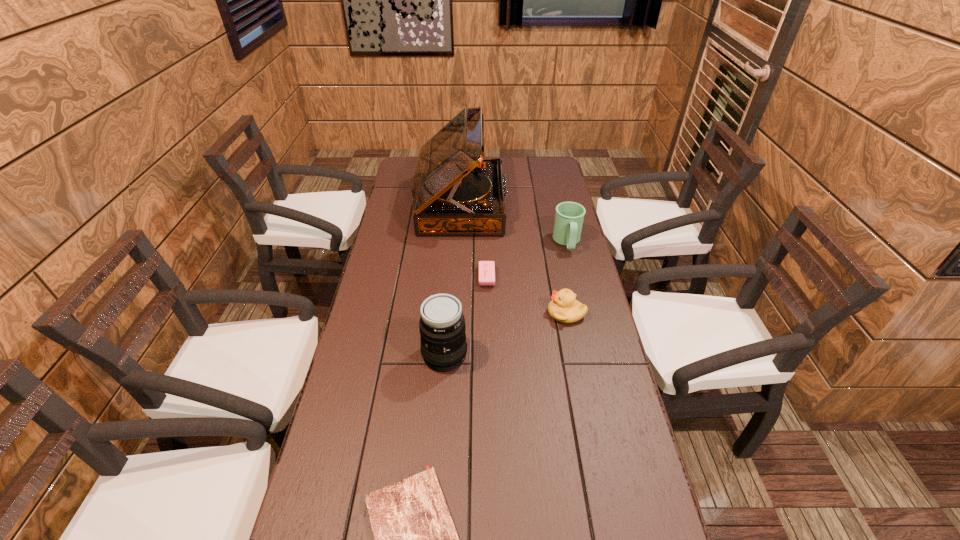
Locate an element on the screen. free area in between the fifth tallest object and the third shortest object is located at coordinates (526, 295).

Where is `free space that is in between the eraser and the second tallest object`? The height and width of the screenshot is (540, 960). free space that is in between the eraser and the second tallest object is located at coordinates (466, 316).

Locate an element on the screen. The width and height of the screenshot is (960, 540). object that is the fourth nearest to the third farthest object is located at coordinates (569, 217).

Choose which object is the third nearest neighbor to the shortest object. Please provide its 2D coordinates. Your answer should be formatted as a tuple, i.e. [(x, y)], where the tuple contains the x and y coordinates of a point satisfying the conditions above.

[(486, 268)]